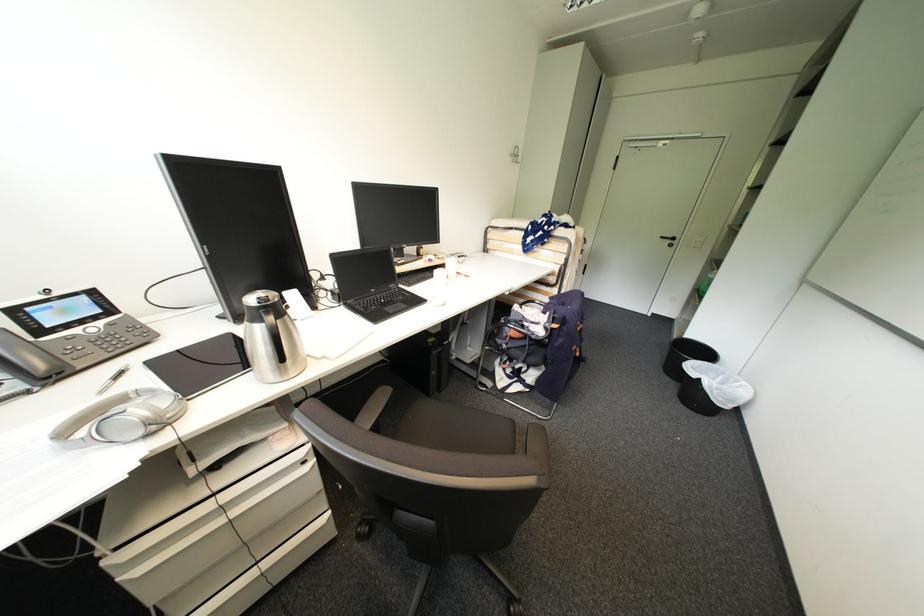
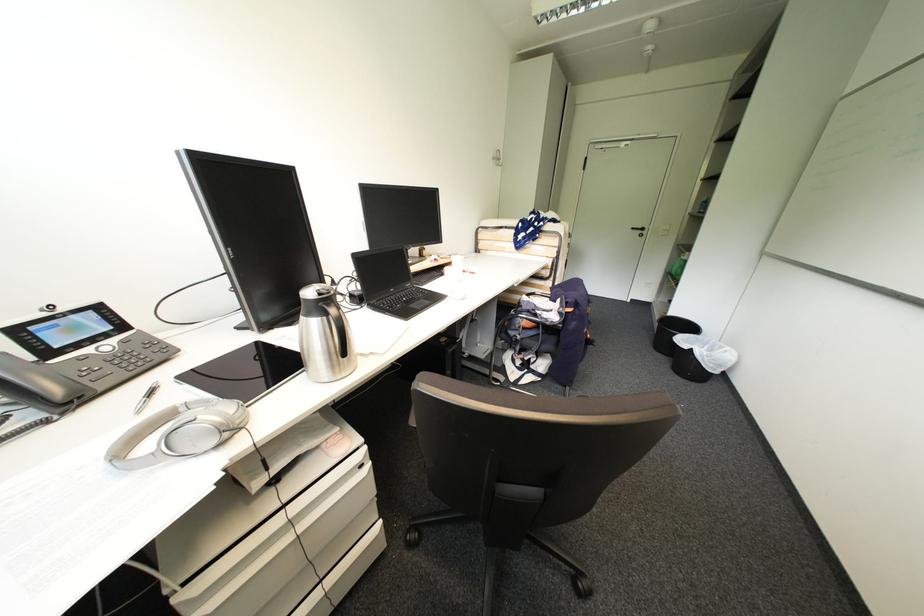
Question: Based on the continuous images, in which direction is the camera rotating? Reply with the corresponding letter.

Choices:
 (A) Left
 (B) Right
 (C) Up
 (D) Down

Answer: (B)